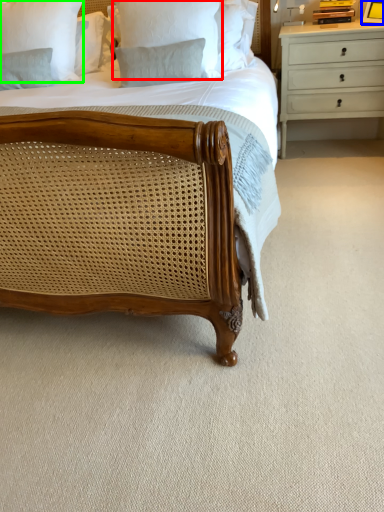
Question: Considering the real-world distances, which object is closest to pillow (highlighted by a red box)? picture frame (highlighted by a blue box) or pillow (highlighted by a green box).

Choices:
 (A) picture frame
 (B) pillow

Answer: (B)